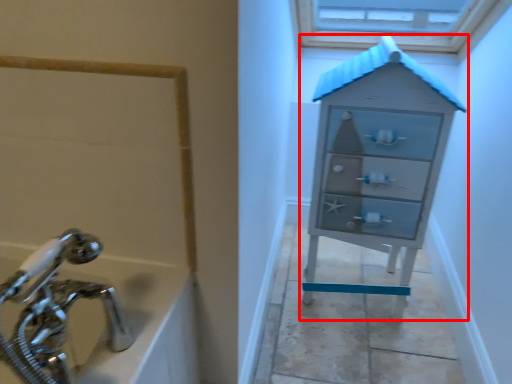
Question: Where is chest of drawers (annotated by the red box) located in relation to tap in the image?

Choices:
 (A) left
 (B) right

Answer: (B)